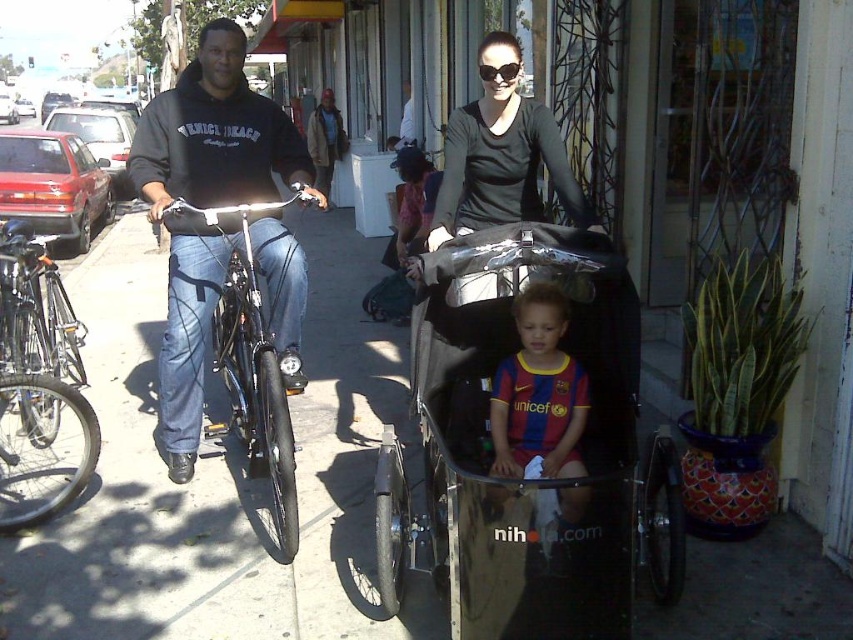
Does smooth concrete sidewalk at center lie in front of shiny black bicycle at left?

Yes, it is.

Can you confirm if smooth concrete sidewalk at center is wider than shiny black bicycle at left?

No, smooth concrete sidewalk at center is not wider than shiny black bicycle at left.

Locate an element on the screen. Image resolution: width=853 pixels, height=640 pixels. smooth concrete sidewalk at center is located at coordinates (222, 477).

Which is in front, point (378, 504) or point (552, 419)?

Point (378, 504) is more forward.

Does point (503, 288) come in front of point (544, 392)?

Yes, point (503, 288) is closer to viewer.

Locate an element on the screen. Image resolution: width=853 pixels, height=640 pixels. metallic silver baby carriage at center is located at coordinates (521, 477).

Which of these two, smooth concrete sidewalk at center or metallic silver baby carriage at center, stands shorter?

With less height is smooth concrete sidewalk at center.

Does smooth concrete sidewalk at center appear on the left side of metallic silver baby carriage at center?

Yes, smooth concrete sidewalk at center is to the left of metallic silver baby carriage at center.

Is point (341, 509) positioned after point (463, 266)?

Yes, it is.

Locate an element on the screen. smooth concrete sidewalk at center is located at coordinates (222, 477).